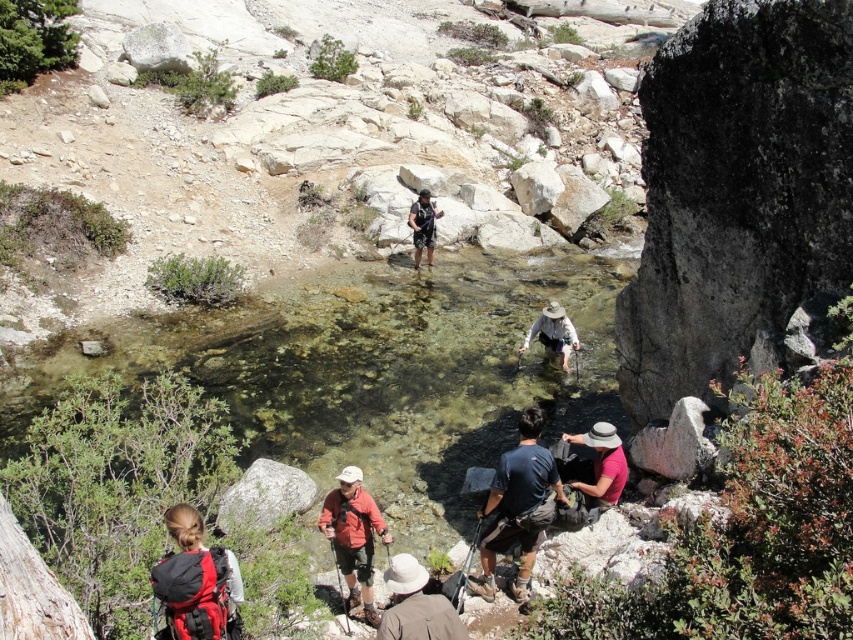
You are a hiker standing at the camera position. You see a point marked at coordinates point (256, 508). Can you reach that point within 30 feet without moving further away from it?

The point (256, 508) is 29.99 feet away from the camera, so yes, you can reach it within 30 feet since it is just slightly under the distance.

You are a hiker planning to cross the stream. You see the red backpack at lower left and the black mesh shirt at center. Which item is narrower in width?

The red backpack at lower left is narrower in width compared to the black mesh shirt at center.

You are a hiker trying to locate your red backpack at lower left. According to the map coordinates provided, where exactly is it positioned?

The red backpack at lower left is located at point (195, 580).